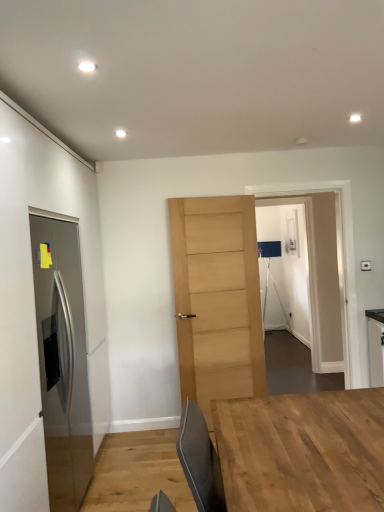
Question: Choose the correct answer: Is light wood door at center, the 2th door when ordered from front to back, inside natural wood table at center or outside it?

Choices:
 (A) inside
 (B) outside

Answer: (B)

Question: From a real-world perspective, is light wood door at center, the 2th door when ordered from front to back, above or below natural wood table at center?

Choices:
 (A) below
 (B) above

Answer: (B)

Question: Which object is positioned farthest from the stainless steel door at left, marked as the first door in a left-to-right arrangement?

Choices:
 (A) light wood door at center, marked as the 1th door in a right-to-left arrangement
 (B) natural wood table at center
 (C) transparent glass door at center, acting as the second glass door starting from the front
 (D) transparent glass door at center, marked as the second glass door in a back-to-front arrangement

Answer: (C)

Question: Which of these objects is positioned closest to the transparent glass door at center, acting as the 1th glass door starting from the front?

Choices:
 (A) stainless steel door at left, positioned as the 2th door in right-to-left order
 (B) natural wood table at center
 (C) light wood door at center, which is the 1th door from back to front
 (D) transparent glass door at center, marked as the 1th glass door in a back-to-front arrangement

Answer: (D)